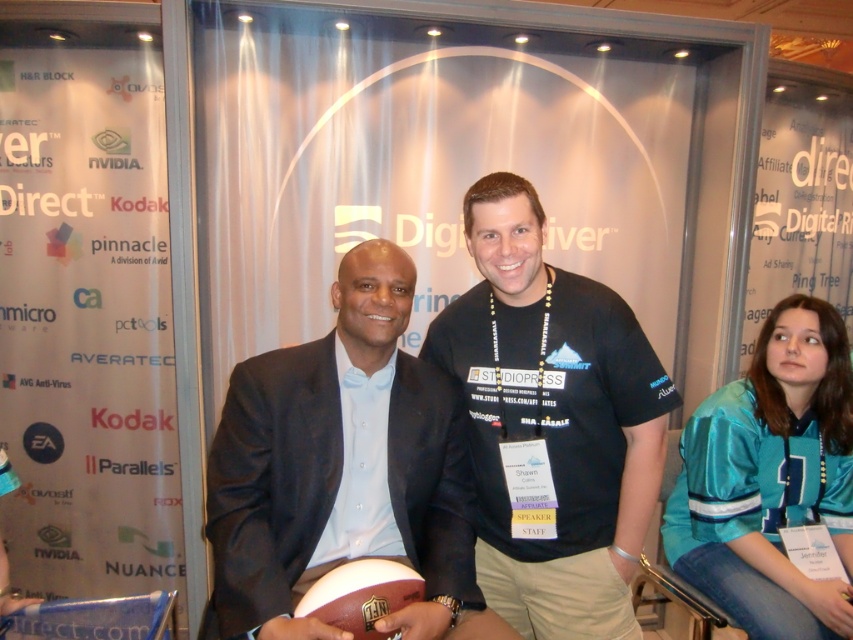
In the scene shown: Is matte black suit at center smaller than black matte t-shirt at center?

Yes.

Can you confirm if matte black suit at center is wider than black matte t-shirt at center?

Correct, the width of matte black suit at center exceeds that of black matte t-shirt at center.

Measure the distance between matte black suit at center and camera.

A distance of 3.97 feet exists between matte black suit at center and camera.

Locate an element on the screen. matte black suit at center is located at coordinates (343, 470).

Is matte black suit at center to the left of teal satin jersey at right from the viewer's perspective?

Indeed, matte black suit at center is positioned on the left side of teal satin jersey at right.

Who is higher up, matte black suit at center or teal satin jersey at right?

matte black suit at center is above.

Identify the location of matte black suit at center. (343, 470).

Where is `matte black suit at center`? matte black suit at center is located at coordinates (343, 470).

Between point (485, 285) and point (763, 556), which one is positioned behind?

The point (763, 556) is behind.

Image resolution: width=853 pixels, height=640 pixels. What do you see at coordinates (552, 424) in the screenshot?
I see `black matte t-shirt at center` at bounding box center [552, 424].

The width and height of the screenshot is (853, 640). Find the location of `black matte t-shirt at center`. black matte t-shirt at center is located at coordinates (552, 424).